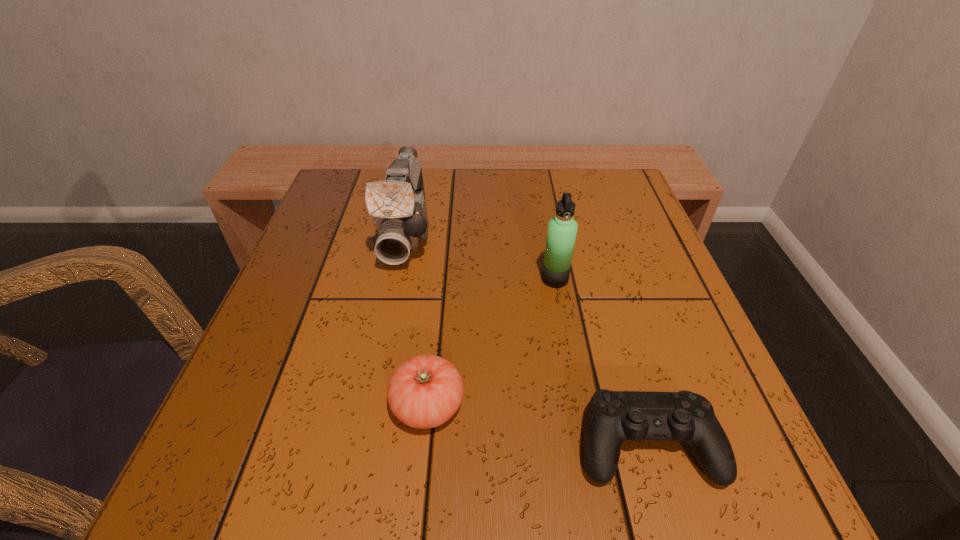
Image resolution: width=960 pixels, height=540 pixels. Identify the location of empty space between the camcorder and the tomato. (418, 318).

You are a GUI agent. You are given a task and a screenshot of the screen. Output one action in this format:
    pyautogui.click(x=<x>, y=<y>)
    Task: Click on the vacant region between the camcorder and the tomato
    
    Given the screenshot: What is the action you would take?
    pyautogui.click(x=418, y=318)

This screenshot has width=960, height=540. Identify the location of free space that is in between the control and the thermos bottle. (601, 362).

Locate an element on the screen. Image resolution: width=960 pixels, height=540 pixels. vacant space that is in between the thermos bottle and the tomato is located at coordinates (492, 342).

Where is `vacant space that is in between the control and the thermos bottle`? vacant space that is in between the control and the thermos bottle is located at coordinates (601, 362).

Where is `free space between the control and the camcorder`? This screenshot has height=540, width=960. free space between the control and the camcorder is located at coordinates click(x=527, y=338).

Where is `free area in between the tomato and the thermos bottle`? free area in between the tomato and the thermos bottle is located at coordinates (492, 342).

You are a GUI agent. You are given a task and a screenshot of the screen. Output one action in this format:
    pyautogui.click(x=<x>, y=<y>)
    Task: Click on the vacant space in between the control and the tomato
    This screenshot has height=540, width=960.
    Given the screenshot: What is the action you would take?
    pyautogui.click(x=538, y=425)

Where is `vacant space that is in between the control and the tomato`? The width and height of the screenshot is (960, 540). vacant space that is in between the control and the tomato is located at coordinates 538,425.

The width and height of the screenshot is (960, 540). In order to click on unoccupied position between the control and the camcorder in this screenshot , I will do `click(527, 338)`.